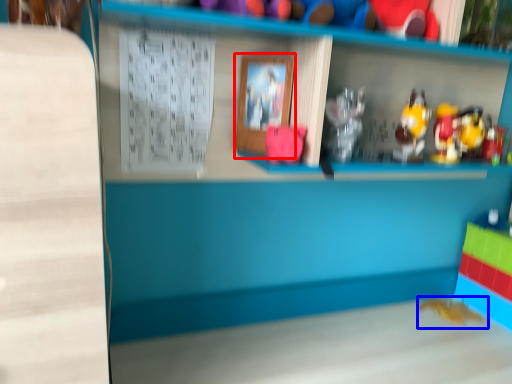
Question: Which object is further to the camera taking this photo, picture frame (highlighted by a red box) or toy (highlighted by a blue box)?

Choices:
 (A) picture frame
 (B) toy

Answer: (B)